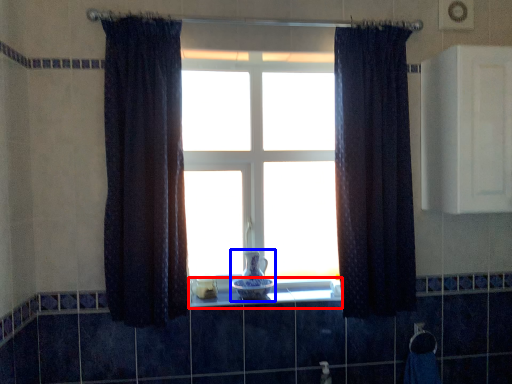
Question: Which of the following is the farthest to the observer, window sill (highlighted by a red box) or glass vase (highlighted by a blue box)?

Choices:
 (A) window sill
 (B) glass vase

Answer: (B)